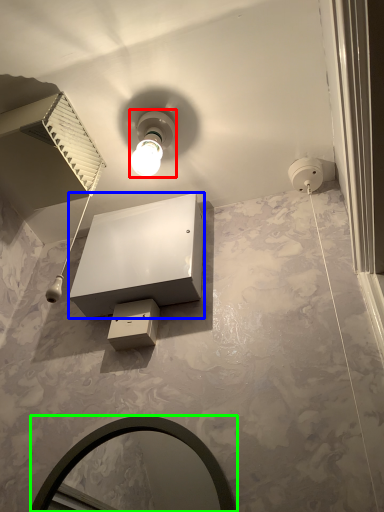
Question: Which object is the closest to the light fixture (highlighted by a red box)? Choose among these: vanity (highlighted by a blue box) or mirror (highlighted by a green box).

Choices:
 (A) vanity
 (B) mirror

Answer: (A)